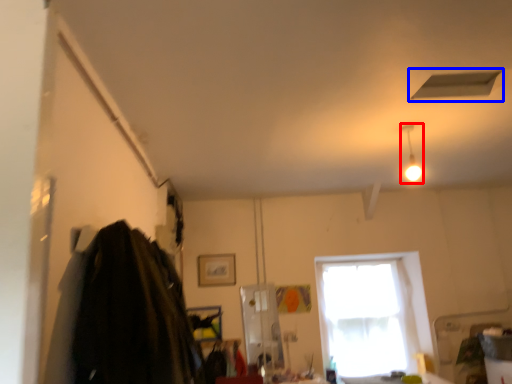
Question: Which point is further to the camera, light fixture (highlighted by a red box) or exhaust hood (highlighted by a blue box)?

Choices:
 (A) light fixture
 (B) exhaust hood

Answer: (A)